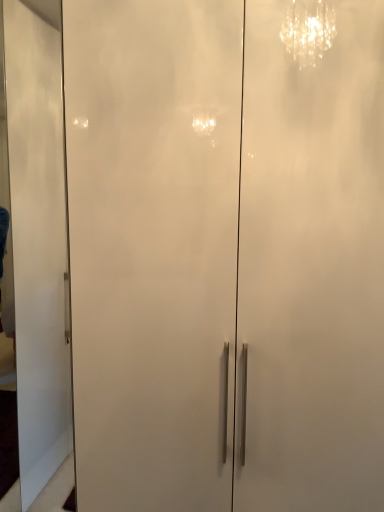
You are a GUI agent. You are given a task and a screenshot of the screen. Output one action in this format:
    pyautogui.click(x=<x>, y=<y>)
    Task: Click on the white glossy door at center
    
    Given the screenshot: What is the action you would take?
    pyautogui.click(x=36, y=236)

From the picture: Measure the distance between white glossy door at center and camera.

The depth of white glossy door at center is 1.73 meters.

Describe the element at coordinates (36, 236) in the screenshot. I see `white glossy door at center` at that location.

This screenshot has height=512, width=384. In order to click on white glossy door at center in this screenshot , I will do tap(36, 236).